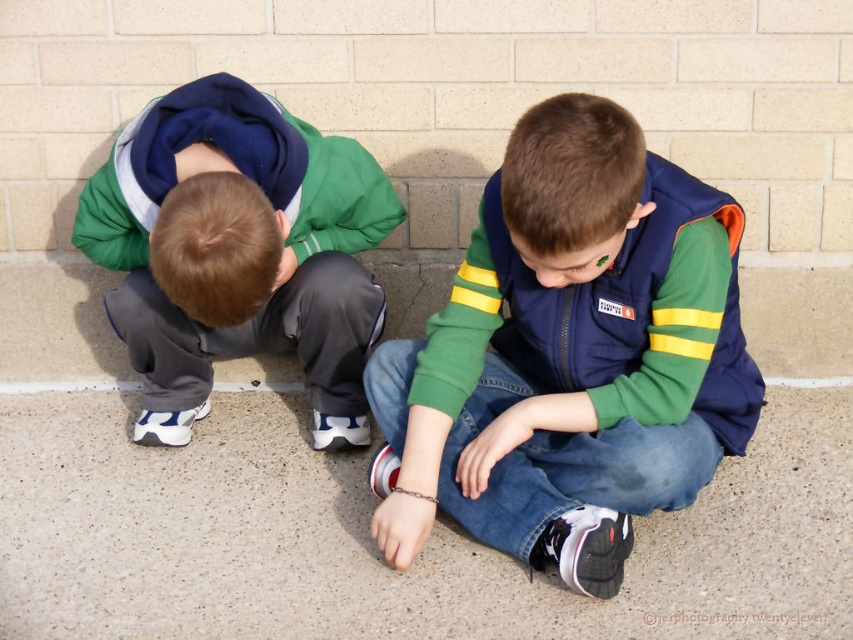
You are a photographer trying to capture a wide shot of the two boys. Given that the navy blue jacket at center and the gray fleece pants at lower left are part of their outfits, which item would require more space in the frame to fully capture its details?

The gray fleece pants at lower left would require more space in the frame since they occupy more space than the navy blue jacket at center.

You are standing at the point marked as point (373, 548) in the image. Looking around, you see two boys. Which direction should you turn to face the boy on the left?

The point (373, 548) is at the lower center, so to face the boy on the left, you should turn to your left.

You are trying to decide whether to place a rectangular mat that is 1 meter wide between the smooth concrete pavement at lower center and the gray fleece pants at lower left. Based on the scene, will the mat fit horizontally between them?

The smooth concrete pavement at lower center is wider than the gray fleece pants at lower left. Since the mat is 1 meter wide, it depends on the actual width of the pavement. However, the description only states the pavement is wider than the pants, not the exact measurement. Therefore, we cannot confirm if the mat will fit without knowing the specific width of the pavement.